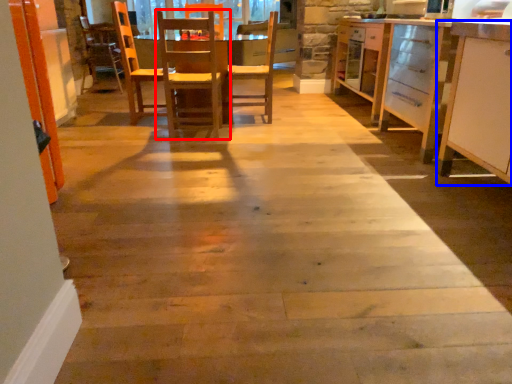
Question: Which point is further to the camera, chair (highlighted by a red box) or cabinetry (highlighted by a blue box)?

Choices:
 (A) chair
 (B) cabinetry

Answer: (A)